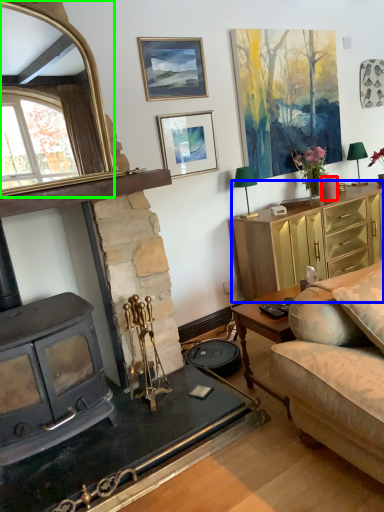
Question: Considering the real-world distances, which object is closest to candle (highlighted by a red box)? cabinetry (highlighted by a blue box) or mirror (highlighted by a green box).

Choices:
 (A) cabinetry
 (B) mirror

Answer: (A)